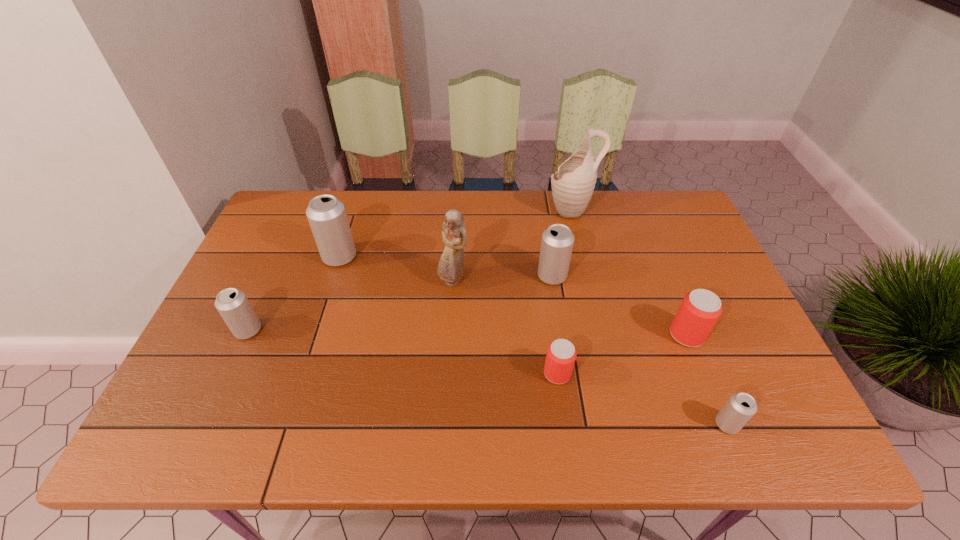
Locate an element on the screen. This screenshot has width=960, height=540. free space in the image that satisfies the following two spatial constraints: 1. at the spout of the tallest object; 2. on the front-facing side of the figurine is located at coordinates (588, 281).

I want to click on vacant space that satisfies the following two spatial constraints: 1. on the front-facing side of the farther red beer can; 2. on the right side of the sixth object from right to left, so click(x=450, y=335).

Identify the location of vacant point that satisfies the following two spatial constraints: 1. on the front side of the second object from left to right; 2. on the left side of the second nearest object. (302, 373).

Where is `free space that satisfies the following two spatial constraints: 1. on the back side of the right red beer can; 2. at the spout of the farthest object`? This screenshot has height=540, width=960. free space that satisfies the following two spatial constraints: 1. on the back side of the right red beer can; 2. at the spout of the farthest object is located at coordinates (636, 210).